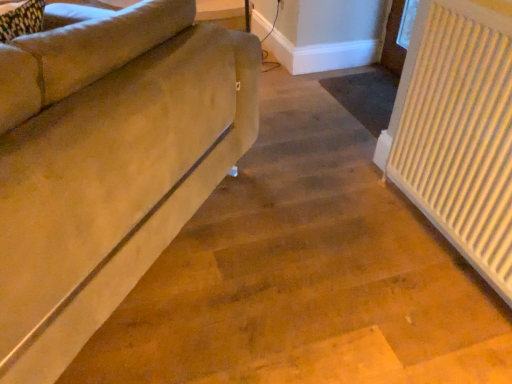
Question: Is suede-like beige couch at left inside the boundaries of white textured radiator at right, or outside?

Choices:
 (A) outside
 (B) inside

Answer: (A)

Question: Is suede-like beige couch at left wider or thinner than white textured radiator at right?

Choices:
 (A) wide
 (B) thin

Answer: (A)

Question: Based on their sizes in the image, would you say suede-like beige couch at left is bigger or smaller than white textured radiator at right?

Choices:
 (A) big
 (B) small

Answer: (A)

Question: From a real-world perspective, is white textured radiator at right above or below suede-like beige couch at left?

Choices:
 (A) below
 (B) above

Answer: (A)

Question: Is white textured radiator at right inside the boundaries of suede-like beige couch at left, or outside?

Choices:
 (A) outside
 (B) inside

Answer: (A)

Question: Considering the positions of white textured radiator at right and suede-like beige couch at left in the image, is white textured radiator at right taller or shorter than suede-like beige couch at left?

Choices:
 (A) short
 (B) tall

Answer: (B)

Question: In the image, is white textured radiator at right positioned in front of or behind suede-like beige couch at left?

Choices:
 (A) behind
 (B) front

Answer: (A)